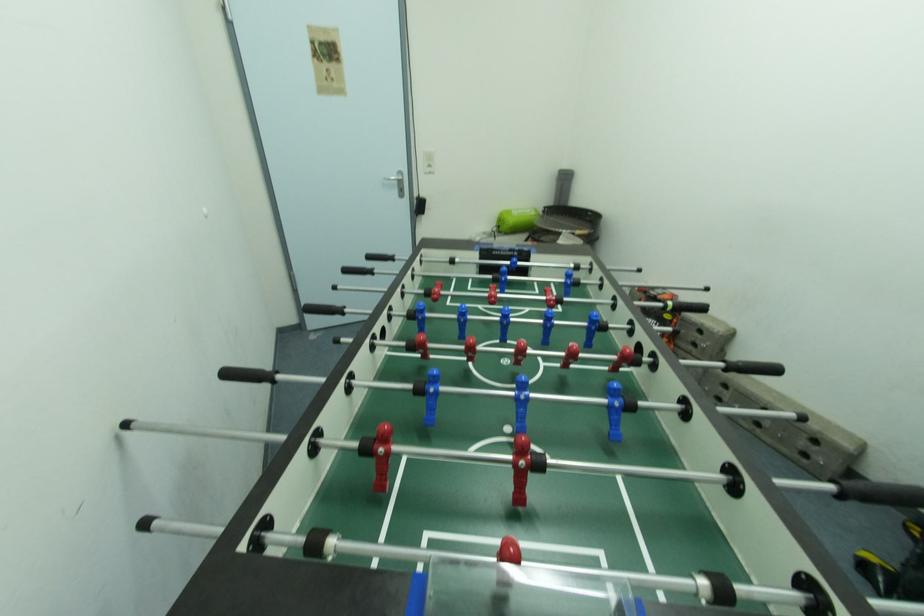
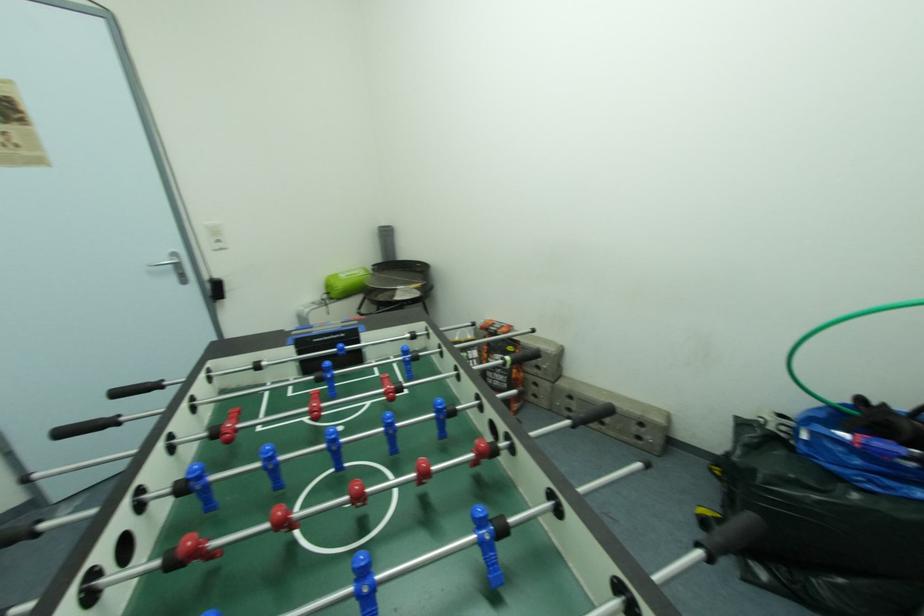
Question: The camera is either moving clockwise (left) or counter-clockwise (right) around the object. The first image is from the beginning of the video and the second image is from the end. Is the camera moving left or right when shooting the video?

Choices:
 (A) Left
 (B) Right

Answer: (A)